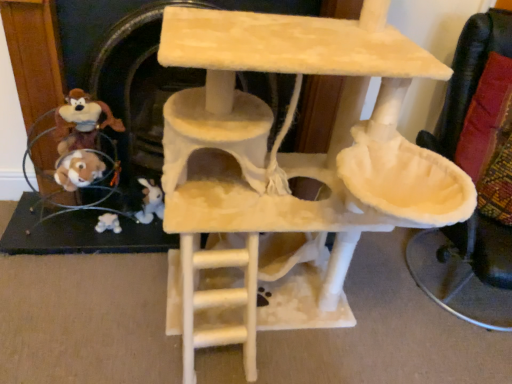
The width and height of the screenshot is (512, 384). Identify the location of white plush toy at lower left, placed as the 2th toy when sorted from top to bottom. (108, 223).

What do you see at coordinates (478, 100) in the screenshot? I see `velvet-like black armchair at right` at bounding box center [478, 100].

Identify the location of beige felt cat tree at center. (288, 166).

From a real-world perspective, which object stands above the other?

velvet-like black armchair at right, from a real-world perspective.

Looking at the image, does beige felt fireplace at center seem bigger or smaller compared to velvet-like black armchair at right?

beige felt fireplace at center is smaller than velvet-like black armchair at right.

Can you confirm if beige felt fireplace at center is wider than velvet-like black armchair at right?

No, beige felt fireplace at center is not wider than velvet-like black armchair at right.

Is beige felt fireplace at center far away from velvet-like black armchair at right?

No, there isn't a large distance between beige felt fireplace at center and velvet-like black armchair at right.

Can you confirm if velvet-like black armchair at right is bigger than beige felt fireplace at center?

Yes, velvet-like black armchair at right is bigger than beige felt fireplace at center.

You are a GUI agent. You are given a task and a screenshot of the screen. Output one action in this format:
    pyautogui.click(x=<x>, y=<y>)
    Task: Click on the armchair in front of the beige felt fireplace at center
    This screenshot has width=512, height=384.
    Given the screenshot: What is the action you would take?
    pyautogui.click(x=478, y=100)

Is velvet-like black armchair at right at the left side of beige felt fireplace at center?

No, velvet-like black armchair at right is not to the left of beige felt fireplace at center.

Which is behind, point (473, 255) or point (290, 91)?

The point (290, 91) is more distant.

How many degrees apart are the facing directions of white plush toy at lower left, placed as the 2th toy when sorted from top to bottom, and beige felt cat tree at center?

The angle between the facing direction of white plush toy at lower left, placed as the 2th toy when sorted from top to bottom, and the facing direction of beige felt cat tree at center is 3.03 degrees.

Is white plush toy at lower left, which is the second toy in front-to-back order, not inside beige felt cat tree at center?

white plush toy at lower left, which is the second toy in front-to-back order, lies outside beige felt cat tree at center's area.

In terms of width, does white plush toy at lower left, the 1th toy from the back, look wider or thinner when compared to beige felt cat tree at center?

Considering their sizes, white plush toy at lower left, the 1th toy from the back, looks slimmer than beige felt cat tree at center.

Between point (104, 219) and point (248, 162), which one is positioned behind?

The point (104, 219) is behind.

What's the angular difference between beige felt cat tree at center and beige felt fireplace at center's facing directions?

They differ by 0.435 degrees in their facing directions.

Looking at this image, from a real-world perspective, is beige felt cat tree at center physically located above or below beige felt fireplace at center?

beige felt cat tree at center is above beige felt fireplace at center.

From the image's perspective, is beige felt cat tree at center positioned above or below beige felt fireplace at center?

beige felt cat tree at center is below beige felt fireplace at center.

Considering the relative sizes of beige felt cat tree at center and beige felt fireplace at center in the image provided, is beige felt cat tree at center shorter than beige felt fireplace at center?

In fact, beige felt cat tree at center may be taller than beige felt fireplace at center.

From a real-world perspective, is white plush toy at lower left, the 1th toy from the back, located higher than velvet-like black armchair at right?

No, from a real-world perspective, white plush toy at lower left, the 1th toy from the back, is not on top of velvet-like black armchair at right.

Is white plush toy at lower left, the 1th toy from the back, touching velvet-like black armchair at right?

No, white plush toy at lower left, the 1th toy from the back, is not next to velvet-like black armchair at right.

Is white plush toy at lower left, placed as the 2th toy when sorted from top to bottom, facing towards velvet-like black armchair at right?

No.

Is white plush toy at lower left, placed as the 2th toy when sorted from top to bottom, in front of or behind velvet-like black armchair at right in the image?

In the image, white plush toy at lower left, placed as the 2th toy when sorted from top to bottom, appears behind velvet-like black armchair at right.

Is point (200, 30) closer or farther from the camera than point (112, 222)?

Point (200, 30) is positioned closer to the camera compared to point (112, 222).

Can you tell me how much beige felt cat tree at center and white plush toy at lower left, the 1th toy from the back, differ in facing direction?

There is a 3.03-degree angle between the facing directions of beige felt cat tree at center and white plush toy at lower left, the 1th toy from the back.

Considering the sizes of objects beige felt cat tree at center and white plush toy at lower left, the 1th toy from the back, in the image provided, who is shorter, beige felt cat tree at center or white plush toy at lower left, the 1th toy from the back,?

white plush toy at lower left, the 1th toy from the back.

Is beige felt cat tree at center facing towards white plush toy at lower left, placed as the 2th toy when sorted from top to bottom?

No, beige felt cat tree at center is not turned towards white plush toy at lower left, placed as the 2th toy when sorted from top to bottom.

Between beige felt cat tree at center and velvet-like black armchair at right, which one appears on the right side from the viewer's perspective?

velvet-like black armchair at right.

Is beige felt cat tree at center far from velvet-like black armchair at right?

They are positioned close to each other.

Identify the location of armchair lying below the beige felt cat tree at center (from the image's perspective). (478, 100).

Relative to velvet-like black armchair at right, is beige felt cat tree at center in front or behind?

beige felt cat tree at center is positioned closer to the viewer than velvet-like black armchair at right.

This screenshot has width=512, height=384. Identify the location of armchair in front of the beige felt fireplace at center. (478, 100).

Identify the location of armchair below the beige felt fireplace at center (from the image's perspective). This screenshot has height=384, width=512. (478, 100).

Looking at this image, considering their positions, is brown plush toy at left, which ranks as the 2th toy in back-to-front order, positioned further to velvet-like black armchair at right than beige felt cat tree at center?

brown plush toy at left, which ranks as the 2th toy in back-to-front order, is positioned further to the anchor velvet-like black armchair at right.

Looking at the image, which one is located further to brown plush toy at left, which ranks as the 2th toy in back-to-front order, velvet-like black armchair at right or beige felt cat tree at center?

Based on the image, velvet-like black armchair at right appears to be further to brown plush toy at left, which ranks as the 2th toy in back-to-front order.

From the image, which object appears to be farther from beige felt fireplace at center, brown plush toy at left, positioned as the 2th toy in bottom-to-top order, or beige felt cat tree at center?

beige felt cat tree at center is positioned further to the anchor beige felt fireplace at center.

When comparing their distances from beige felt cat tree at center, does velvet-like black armchair at right or white plush toy at lower left, placed as the 2th toy when sorted from top to bottom, seem closer?

Among the two, velvet-like black armchair at right is located nearer to beige felt cat tree at center.

Looking at this image, based on their spatial positions, is brown plush toy at left, which is the 1th toy in front-to-back order, or beige felt fireplace at center closer to beige felt cat tree at center?

The object closer to beige felt cat tree at center is beige felt fireplace at center.

Which object lies nearer to the anchor point brown plush toy at left, positioned as the 2th toy in bottom-to-top order, beige felt cat tree at center or white plush toy at lower left, which is the second toy in front-to-back order?

Among the two, white plush toy at lower left, which is the second toy in front-to-back order, is located nearer to brown plush toy at left, positioned as the 2th toy in bottom-to-top order.

Estimate the real-world distances between objects in this image. Which object is further from beige felt fireplace at center, beige felt cat tree at center or white plush toy at lower left, the first toy ordered from the bottom?

Based on the image, white plush toy at lower left, the first toy ordered from the bottom, appears to be further to beige felt fireplace at center.

Based on their spatial positions, is white plush toy at lower left, which is the second toy in front-to-back order, or beige felt cat tree at center further from beige felt fireplace at center?

white plush toy at lower left, which is the second toy in front-to-back order, lies further to beige felt fireplace at center than the other object.

Where is `fireplace between brown plush toy at left, which ranks as the 2th toy in back-to-front order, and velvet-like black armchair at right, in the horizontal direction`? The image size is (512, 384). fireplace between brown plush toy at left, which ranks as the 2th toy in back-to-front order, and velvet-like black armchair at right, in the horizontal direction is located at coordinates (140, 90).

Identify the location of furniture between white plush toy at lower left, the first toy ordered from the bottom, and velvet-like black armchair at right, in the horizontal direction. The height and width of the screenshot is (384, 512). (288, 166).

Find the location of a particular element. furniture between beige felt fireplace at center and velvet-like black armchair at right in the horizontal direction is located at coordinates click(288, 166).

You are a GUI agent. You are given a task and a screenshot of the screen. Output one action in this format:
    pyautogui.click(x=<x>, y=<y>)
    Task: Click on the fireplace between beige felt cat tree at center and white plush toy at lower left, which is the second toy in front-to-back order, in the front-back direction
    
    Given the screenshot: What is the action you would take?
    [140, 90]